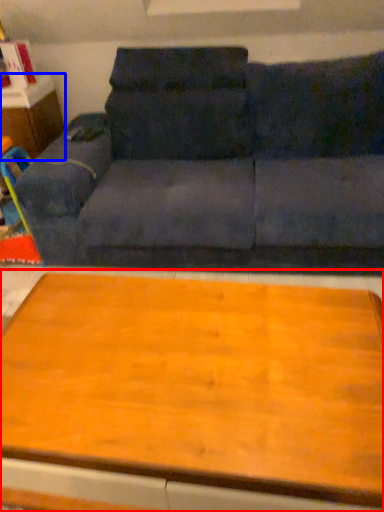
Question: Which point is closer to the camera, table (highlighted by a red box) or dresser (highlighted by a blue box)?

Choices:
 (A) table
 (B) dresser

Answer: (A)